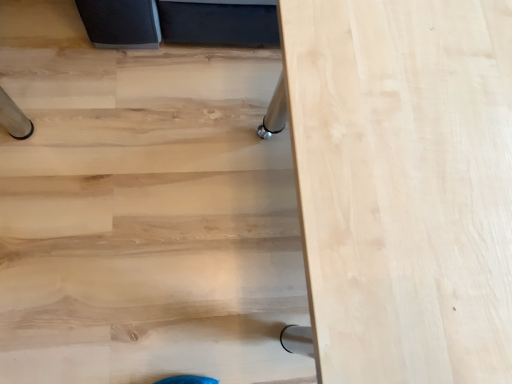
Where is `free point above natural wood table at center (from a real-world perspective)`? free point above natural wood table at center (from a real-world perspective) is located at coordinates (428, 165).